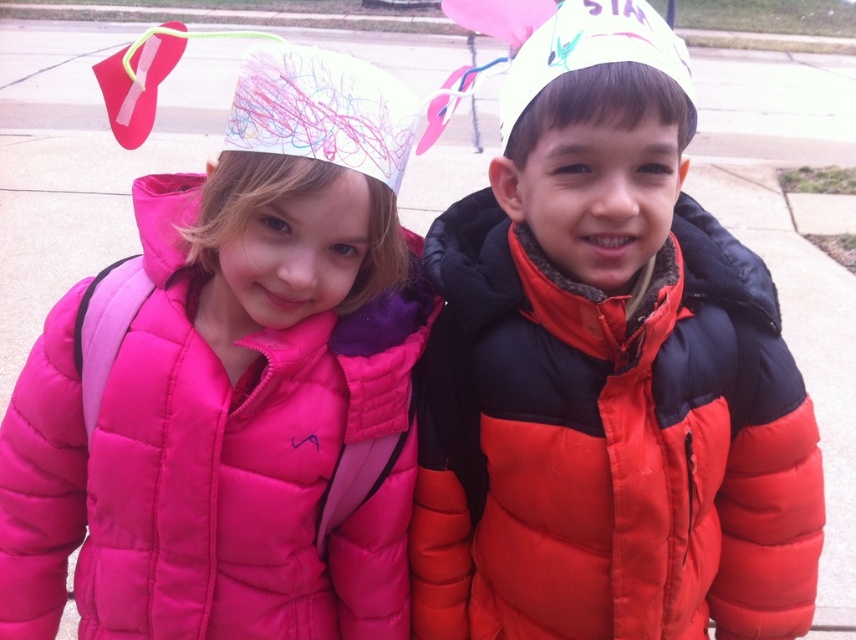
Does matte black jacket at center come behind matte pink puffer jacket at upper left?

That is False.

The height and width of the screenshot is (640, 856). What are the coordinates of `matte black jacket at center` in the screenshot? It's located at (605, 374).

Image resolution: width=856 pixels, height=640 pixels. I want to click on matte black jacket at center, so click(605, 374).